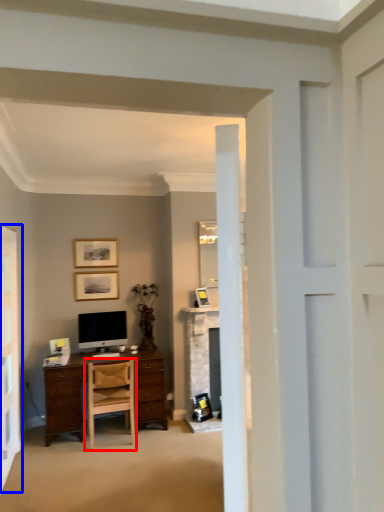
Question: Which object is closer to the camera taking this photo, chair (highlighted by a red box) or screen door (highlighted by a blue box)?

Choices:
 (A) chair
 (B) screen door

Answer: (B)